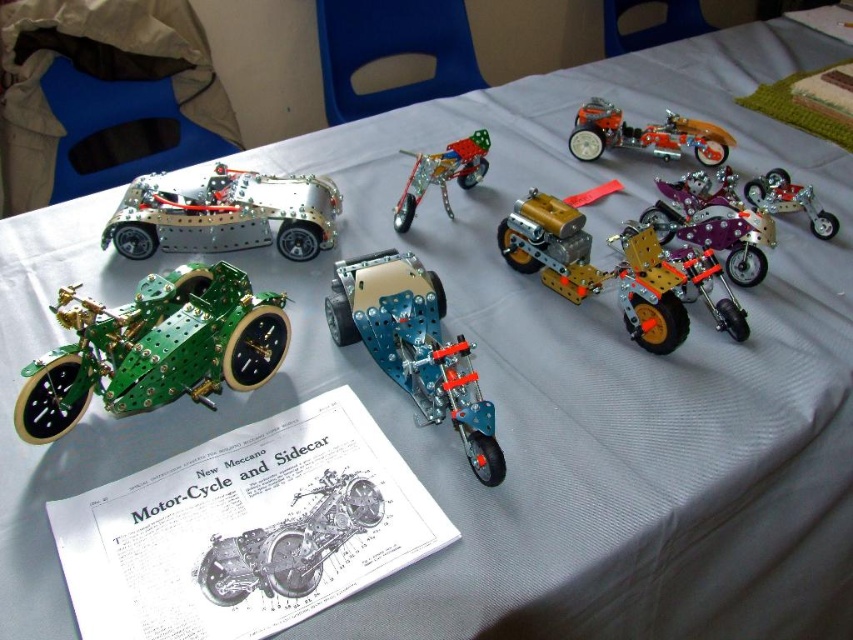
Between point (251, 220) and point (583, 160), which one is positioned in front?

Positioned in front is point (251, 220).

Can you confirm if brushed metal car at left is wider than orange metallic motorcycle at center?

Yes, brushed metal car at left is wider than orange metallic motorcycle at center.

Between point (207, 196) and point (605, 147), which one is positioned in front?

Point (207, 196) is in front.

Where is `brushed metal car at left`? brushed metal car at left is located at coordinates (225, 216).

Does point (482, 172) come in front of point (776, 173)?

No, it is behind (776, 173).

Is metallic/transparent motorcycle at center thinner than metallic gold motorcycle at right?

No, metallic/transparent motorcycle at center is not thinner than metallic gold motorcycle at right.

What do you see at coordinates (442, 173) in the screenshot?
I see `metallic/transparent motorcycle at center` at bounding box center [442, 173].

At what (x,y) coordinates should I click in order to perform the action: click on metallic/transparent motorcycle at center. Please return your answer as a coordinate pair (x, y). The image size is (853, 640). Looking at the image, I should click on (442, 173).

Is brushed metal car at left behind metallic gold motorcycle at right?

No, brushed metal car at left is closer to the viewer.

Is brushed metal car at left to the left of metallic gold motorcycle at right from the viewer's perspective?

Indeed, brushed metal car at left is positioned on the left side of metallic gold motorcycle at right.

Does point (239, 221) come closer to viewer compared to point (822, 209)?

Yes, it is in front of point (822, 209).

Identify the location of brushed metal car at left. pyautogui.click(x=225, y=216).